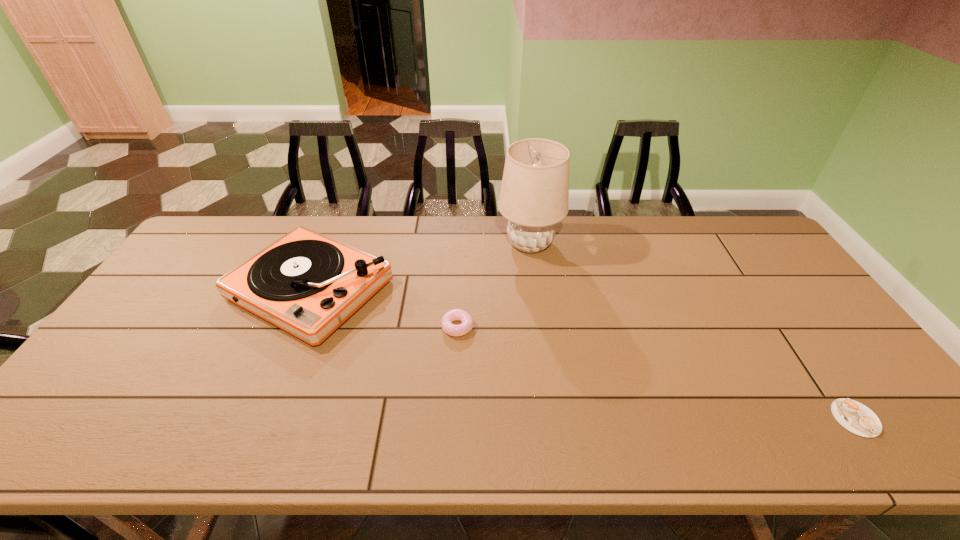
Where is `free space located 0.050m on the back of the third object from right to left`? The height and width of the screenshot is (540, 960). free space located 0.050m on the back of the third object from right to left is located at coordinates (459, 302).

Image resolution: width=960 pixels, height=540 pixels. I want to click on vacant space located on the back of the shortest object, so pos(794,329).

Locate an element on the screen. lampshade present at the far edge is located at coordinates (534, 195).

Identify the location of record player that is at the far edge. (307, 284).

The image size is (960, 540). Identify the location of object present at the near edge. (857, 418).

I want to click on object present at the right edge, so click(857, 418).

Find the location of a particular element. object that is at the near right corner is located at coordinates (857, 418).

At what (x,y) coordinates should I click in order to perform the action: click on vacant space at the far edge. Please return your answer as a coordinate pair (x, y). Looking at the image, I should click on (595, 252).

Locate an element on the screen. vacant point at the near edge is located at coordinates (362, 453).

This screenshot has width=960, height=540. I want to click on blank area at the left edge, so click(x=153, y=318).